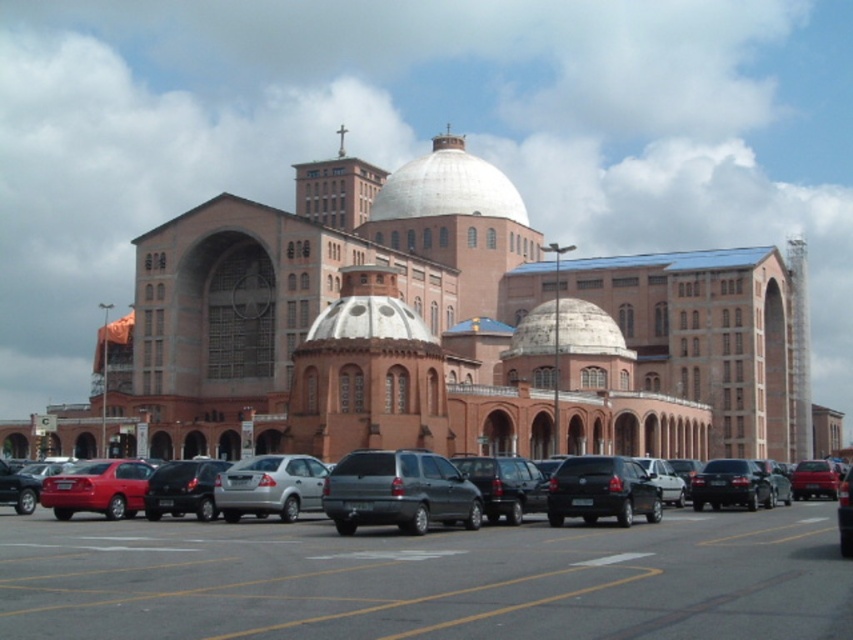
You are standing in front of the church and want to take a photo of the white matte dome at center. If your camera can focus on objects up to 120 meters away, will it be able to capture the dome clearly?

The white matte dome at center and camera are 127.41 meters apart from each other, which is beyond the camera focus range of 120 meters. Therefore, the camera cannot capture the dome clearly.

You are standing in front of the cathedral and see two points marked on the building. The first point is at coordinates point (157, 548) and the second point is at point (492, 170). Which of these points is closer to you?

Point (157, 548) is in front of point (492, 170), so it is closer to you.

You are a photographer standing in front of the cathedral. You want to capture both the white matte dome at center and the satin black suv at center in a single shot. Which object will appear bigger in the photo?

The white matte dome at center will appear bigger in the photo because it has a larger size compared to the satin black suv at center.